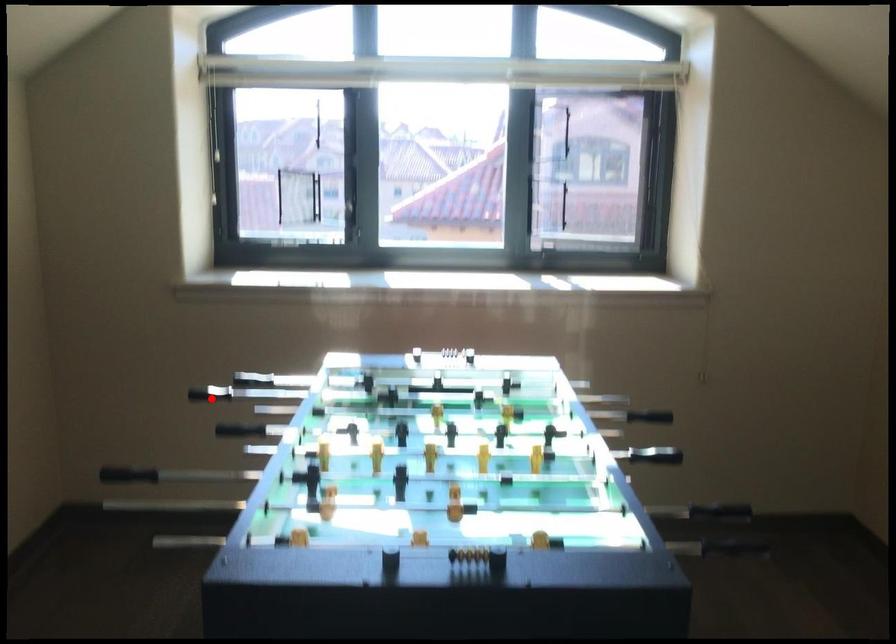
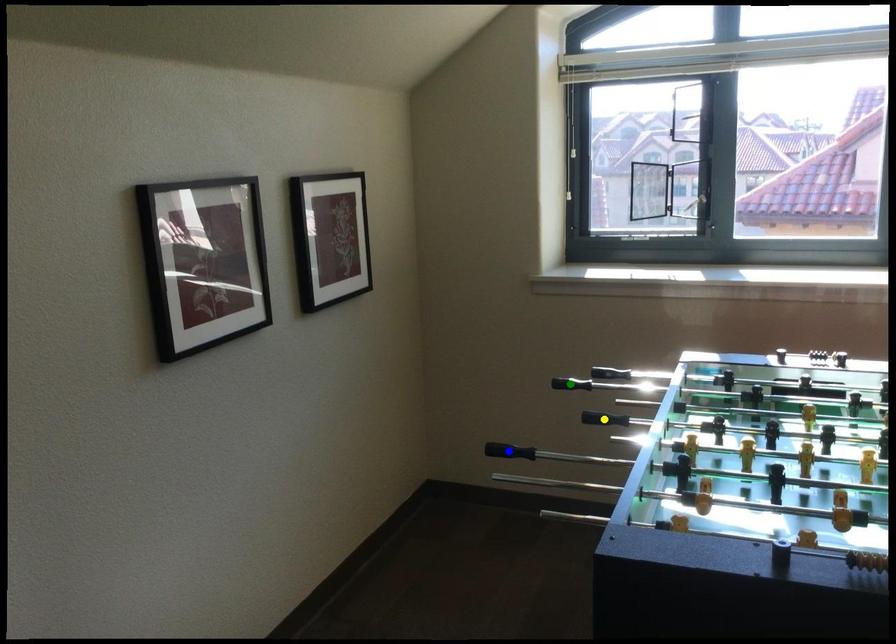
Question: I am providing you with two images of the same scene from different viewpoints. A red point is marked on the first image. You are given multiple points on the second image. Which mark in image 2 goes with the point in image 1?

Choices:
 (A) green point
 (B) yellow point
 (C) blue point

Answer: (A)